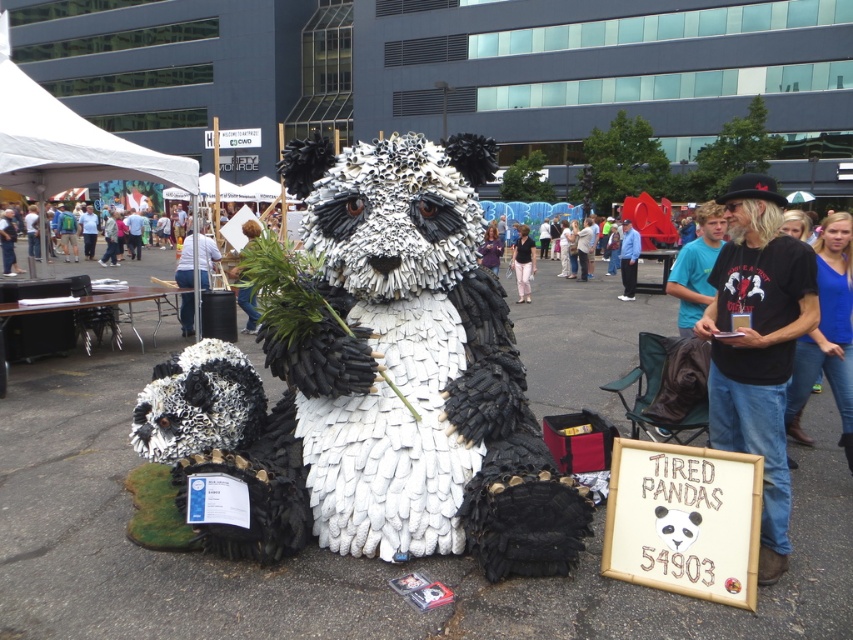
Question: Can you confirm if blue cotton shirt at right is smaller than white fabric shirt at center?

Choices:
 (A) no
 (B) yes

Answer: (B)

Question: Considering the real-world distances, which object is closest to the light blue shirt at center?

Choices:
 (A) denim pants at center
 (B) white fabric shirt at center
 (C) blue t-shirt at center

Answer: (B)

Question: Is light blue shirt at center positioned in front of blue jeans at center?

Choices:
 (A) no
 (B) yes

Answer: (B)

Question: Observing the image, what is the correct spatial positioning of black t-shirt at right in reference to blue jeans at center?

Choices:
 (A) right
 (B) left

Answer: (B)

Question: Which point is farther to the camera?

Choices:
 (A) white fabric canopy at upper left
 (B) denim pants at center
 (C) blue jeans at center
 (D) blue cotton shirt at right

Answer: (C)

Question: Which object appears closest to the camera in this image?

Choices:
 (A) white fabric shirt at center
 (B) blue t-shirt at center
 (C) black t-shirt at right

Answer: (C)